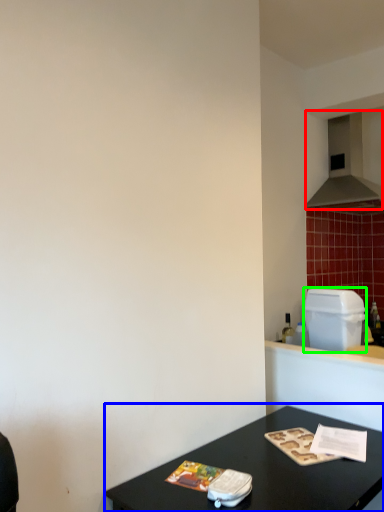
Question: Estimate the real-world distances between objects in this image. Which object is farther from exhaust hood (highlighted by a red box), table (highlighted by a blue box) or appliance (highlighted by a green box)?

Choices:
 (A) table
 (B) appliance

Answer: (A)